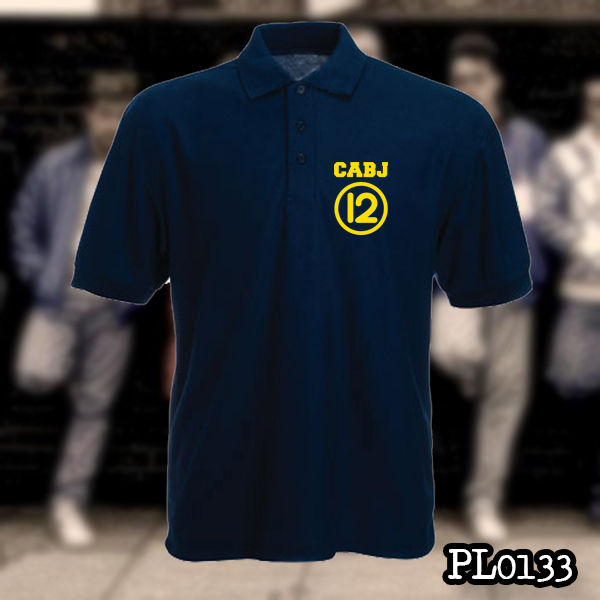
The image size is (600, 600). In order to click on tile flooring in this screenshot , I will do `click(144, 573)`.